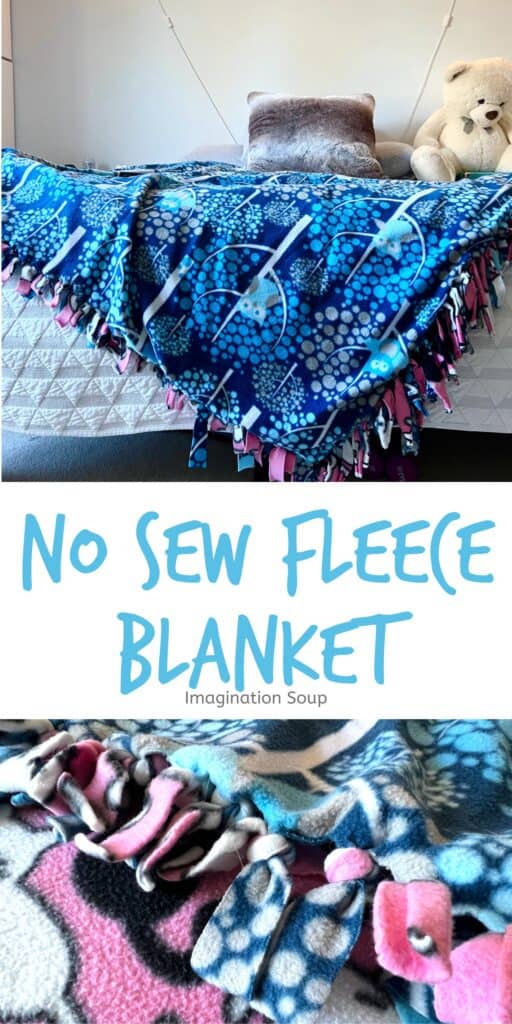
Identify the location of pillow. (323, 123).